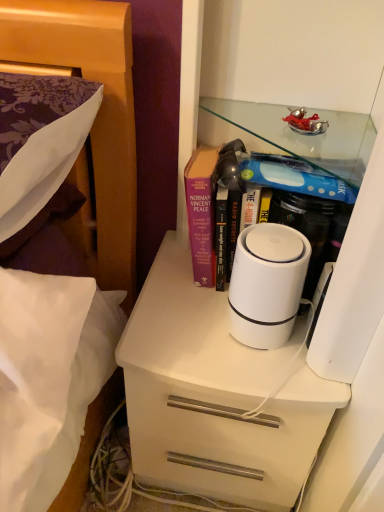
Locate an element on the screen. vacant region to the left of white matte cylindrical device at center is located at coordinates (175, 322).